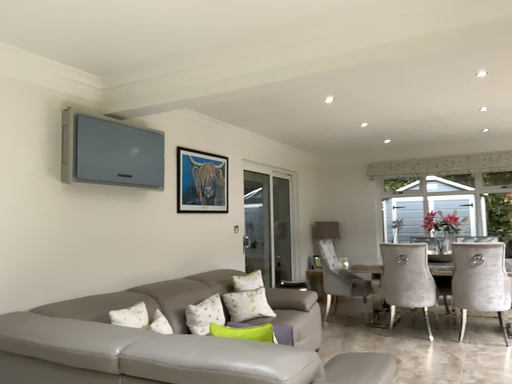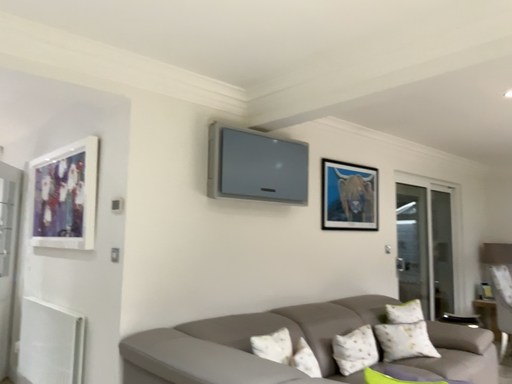
Question: How did the camera likely rotate when shooting the video?

Choices:
 (A) rotated right
 (B) rotated left

Answer: (B)